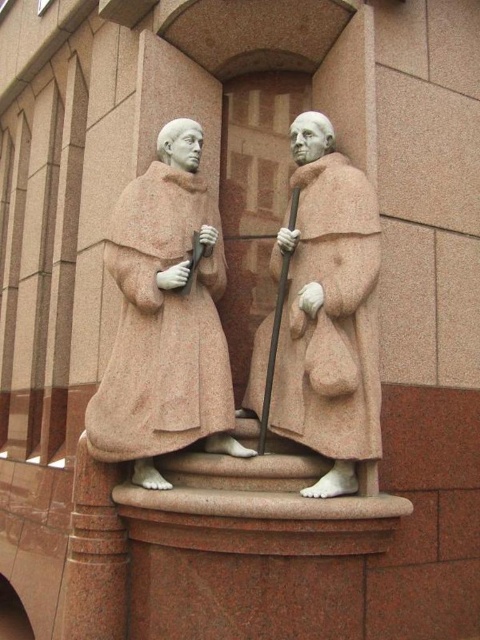
Question: Which point is closer to the camera?

Choices:
 (A) rustic stone robe at center
 (B) pink stone robe at center

Answer: (B)

Question: Which object is closer to the camera taking this photo?

Choices:
 (A) rustic stone robe at center
 (B) pink stone robe at center

Answer: (B)

Question: Does rustic stone robe at center have a lesser width compared to pink stone robe at center?

Choices:
 (A) no
 (B) yes

Answer: (A)

Question: Is rustic stone robe at center positioned at the back of pink stone robe at center?

Choices:
 (A) yes
 (B) no

Answer: (A)

Question: Is rustic stone robe at center to the left of pink stone robe at center from the viewer's perspective?

Choices:
 (A) no
 (B) yes

Answer: (B)

Question: Which of the following is the closest to the observer?

Choices:
 (A) pink stone robe at center
 (B) rustic stone robe at center

Answer: (A)